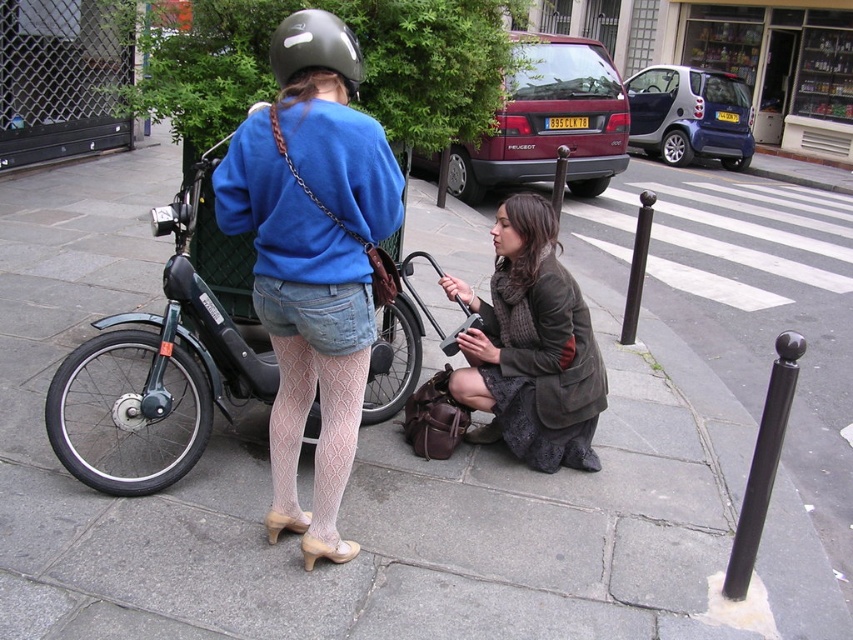
You are a delivery person who needs to secure a package on the scooter. The package requires that the distance between the matte blue sweater at center and the matte black helmet at upper center must be at least 20 inches to ensure stability. Can you proceed with placing the package as planned?

The distance between the matte blue sweater at center and the matte black helmet at upper center is 17.72 inches, which is less than the required 20 inches. Therefore, you cannot proceed with placing the package as planned.

In the scene shown: You are standing at the point labeled as point (352,154) in the image. A friend is approaching you from the direction of the parked scooter. How far will your friend have to walk to reach you?

The point labeled point (352,154) is 2.41 meters away from the viewer, so your friend will have to walk 2.41 meters to reach you.

You are a delivery person who needs to quickly access your scooter located at the center of the scene. You see the black matte bicycle at center and the denim shorts at center. Which object is closer to you?

The black matte bicycle at center is closer to you because the denim shorts at center is behind it.